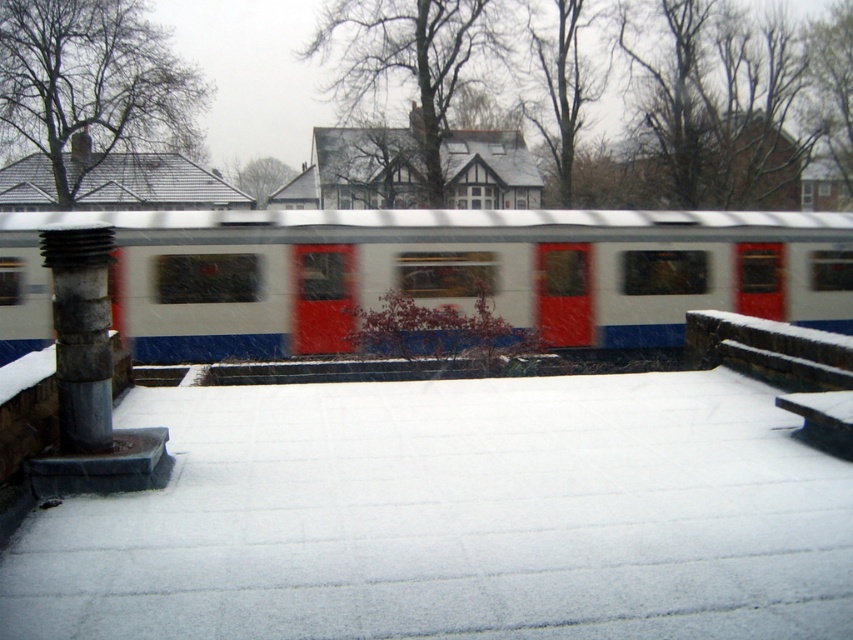
You are a photographer trying to capture a clear shot of the white glossy train at center and the rusty metallic column at left. Since the train is moving, you want to know if the train will pass in front of the column. Based on the scene description, can you determine if the train is positioned in front of the column?

The white glossy train at center is taller than the rusty metallic column at left. Since the train is moving from left to right and is taller, it would pass in front of the column, blocking it temporarily during its movement.